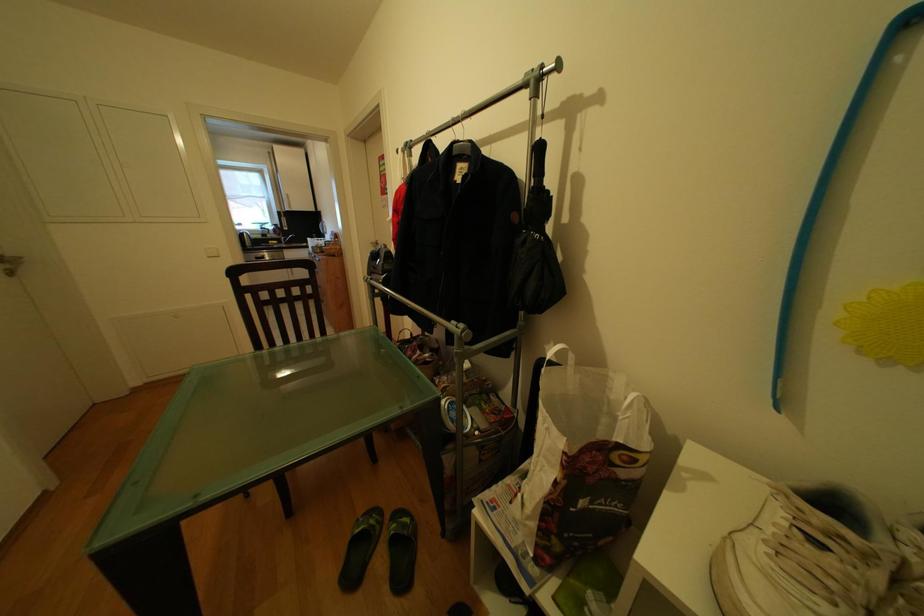
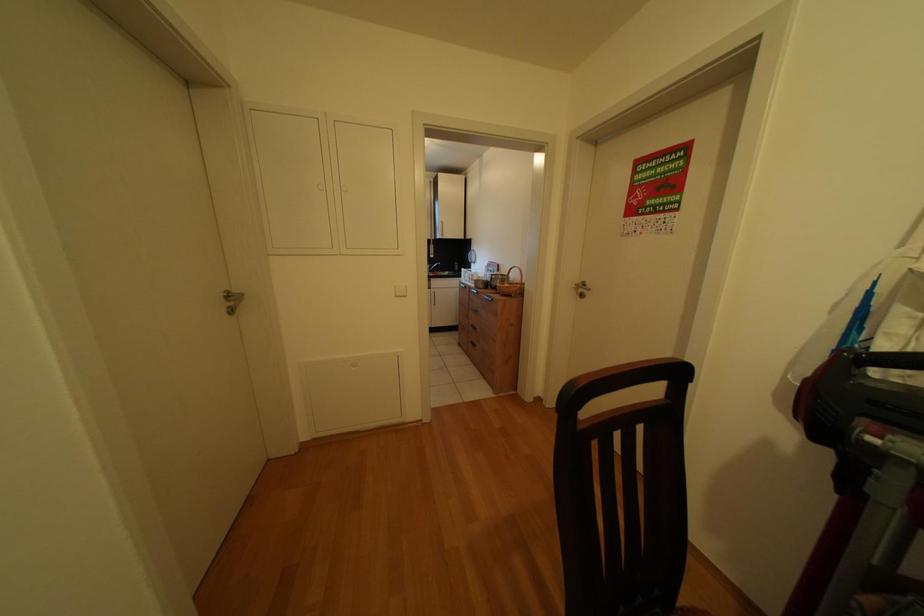
What movement of the cameraman would produce the second image?

The movement direction of the cameraman is left, forward.